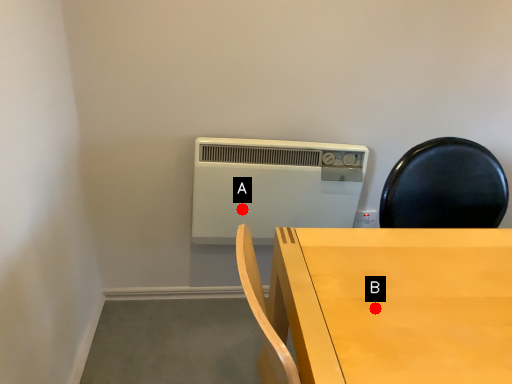
Question: Two points are circled on the image, labeled by A and B beside each circle. Which point appears farthest from the camera in this image?

Choices:
 (A) A is further
 (B) B is further

Answer: (A)